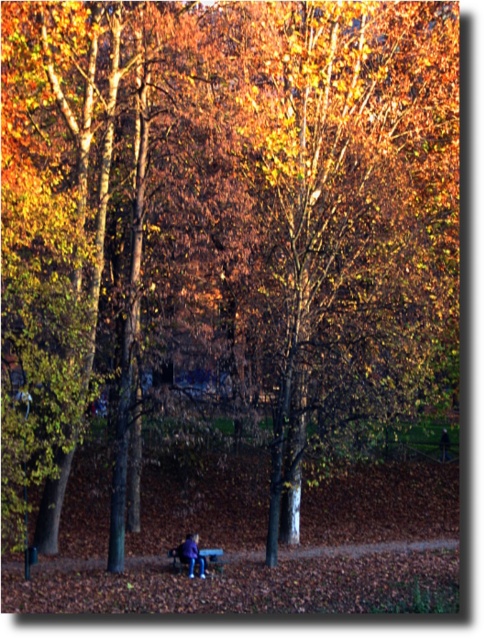
You are planning to sit on the wooden park bench at lower center while wearing the blue denim jeans at lower center. Considering their sizes, will there be enough space for both you and the jeans on the bench?

The wooden park bench at lower center is smaller in size compared to the blue denim jeans at lower center. This means the bench may not provide sufficient space to comfortably sit while wearing the jeans, as the jeans take up more area. Consider looking for a larger bench or another seating option.